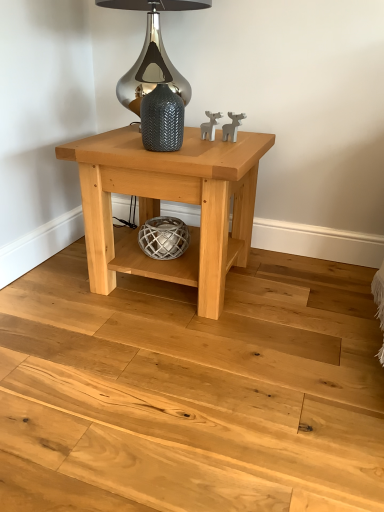
Question: From their relative heights in the image, would you say natural wood floor at center is taller or shorter than textured gray vase at center?

Choices:
 (A) tall
 (B) short

Answer: (B)

Question: From the image's perspective, is natural wood floor at center located above or below textured gray vase at center?

Choices:
 (A) below
 (B) above

Answer: (A)

Question: Which is nearer to the natural wood table at center?

Choices:
 (A) textured gray vase at center
 (B) natural wood floor at center
 (C) satin silver glass at upper center

Answer: (A)

Question: Which object is positioned farthest from the satin silver glass at upper center?

Choices:
 (A) natural wood floor at center
 (B) natural wood table at center
 (C) textured gray vase at center

Answer: (A)